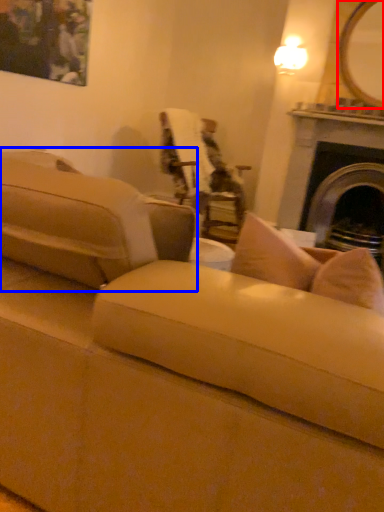
Question: Among these objects, which one is farthest to the camera, mirror (highlighted by a red box) or studio couch (highlighted by a blue box)?

Choices:
 (A) mirror
 (B) studio couch

Answer: (A)